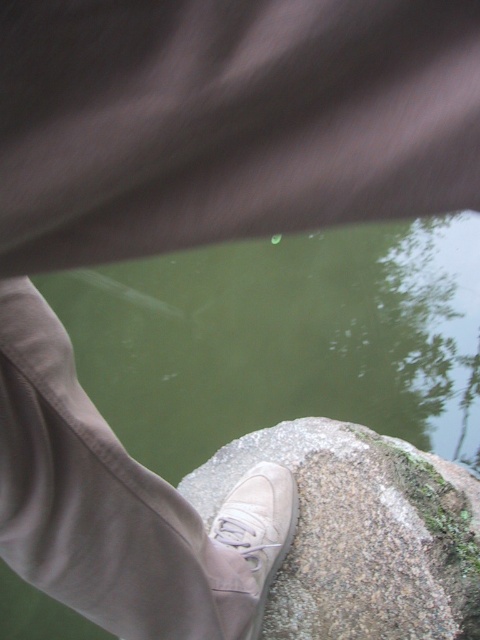
Who is shorter, green water at center or gray rough rock at center?

gray rough rock at center

Is point (241, 392) positioned before point (464, 486)?

That is False.

Is point (147, 412) positioned behind point (352, 422)?

Yes.

In order to click on green water at center in this screenshot , I will do `click(285, 339)`.

Does gray rough rock at center lie in front of suede/leather shoe at center?

No.

Between gray rough rock at center and suede/leather shoe at center, which one is positioned higher?

gray rough rock at center is higher up.

What do you see at coordinates (361, 532) in the screenshot?
I see `gray rough rock at center` at bounding box center [361, 532].

Find the location of a particular element. Image resolution: width=480 pixels, height=640 pixels. gray rough rock at center is located at coordinates (361, 532).

Can you confirm if green water at center is thinner than suede/leather shoe at center?

In fact, green water at center might be wider than suede/leather shoe at center.

Does green water at center appear over suede/leather shoe at center?

Correct, green water at center is located above suede/leather shoe at center.

Does point (305, 305) come in front of point (225, 536)?

No, (305, 305) is behind (225, 536).

Identify the location of green water at center. (285, 339).